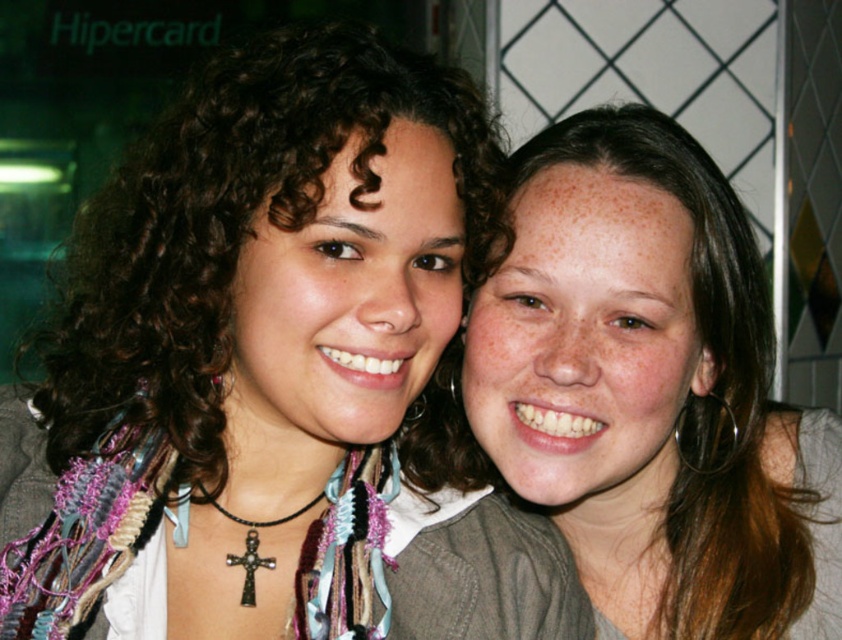
Is matte black necklace at center wider than light brown hair at center?

Yes, matte black necklace at center is wider than light brown hair at center.

Can you confirm if matte black necklace at center is positioned to the right of light brown hair at center?

In fact, matte black necklace at center is to the left of light brown hair at center.

Does point (352, 136) come closer to viewer compared to point (769, 323)?

Yes.

The image size is (842, 640). Identify the location of matte black necklace at center. (274, 372).

Can you confirm if matte black necklace at center is thinner than black metallic cross at center?

In fact, matte black necklace at center might be wider than black metallic cross at center.

Which of these two, matte black necklace at center or black metallic cross at center, stands shorter?

black metallic cross at center

Does point (345, 557) come behind point (228, 560)?

That is False.

What are the coordinates of `matte black necklace at center` in the screenshot? It's located at (274, 372).

Is light brown hair at center above black metallic cross at center?

Correct, light brown hair at center is located above black metallic cross at center.

What do you see at coordinates (653, 388) in the screenshot?
I see `light brown hair at center` at bounding box center [653, 388].

This screenshot has width=842, height=640. Identify the location of light brown hair at center. (653, 388).

Where is `light brown hair at center`? This screenshot has height=640, width=842. light brown hair at center is located at coordinates (653, 388).